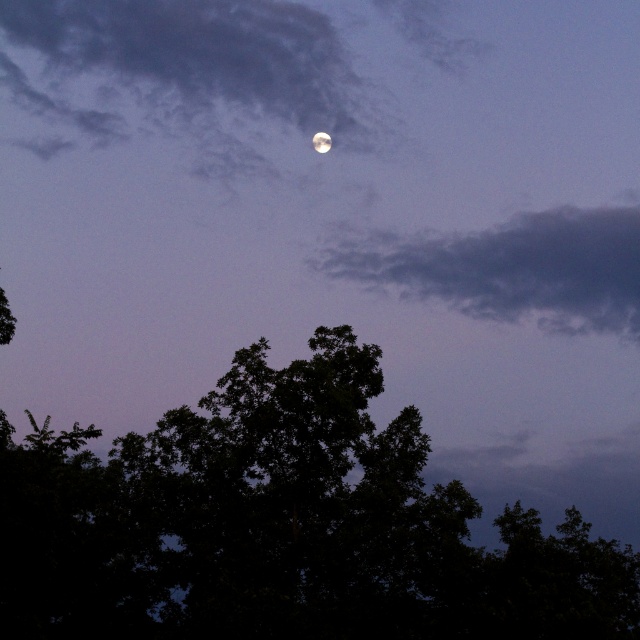
Is green leafy tree at center below cloudy sky at upper center?

Correct, green leafy tree at center is located below cloudy sky at upper center.

Who is positioned more to the left, green leafy tree at center or cloudy sky at upper center?

cloudy sky at upper center is more to the left.

Which is behind, point (365, 552) or point (17, 42)?

The point (17, 42) is more distant.

At what (x,y) coordinates should I click in order to perform the action: click on green leafy tree at center. Please return your answer as a coordinate pair (x, y). This screenshot has width=640, height=640. Looking at the image, I should click on (284, 525).

Can you confirm if gray matte cloud at upper center is bigger than smooth silver moon at upper center?

Yes.

Between gray matte cloud at upper center and smooth silver moon at upper center, which one appears on the right side from the viewer's perspective?

Positioned to the right is gray matte cloud at upper center.

Is point (538, 225) positioned behind point (314, 138)?

That is True.

Where is `gray matte cloud at upper center`? This screenshot has height=640, width=640. gray matte cloud at upper center is located at coordinates (513, 268).

At what (x,y) coordinates should I click in order to perform the action: click on cloudy sky at upper center. Please return your answer as a coordinate pair (x, y). This screenshot has width=640, height=640. Looking at the image, I should click on (186, 76).

Between point (124, 81) and point (324, 150), which one is positioned in front?

Point (324, 150) is more forward.

The height and width of the screenshot is (640, 640). I want to click on cloudy sky at upper center, so click(186, 76).